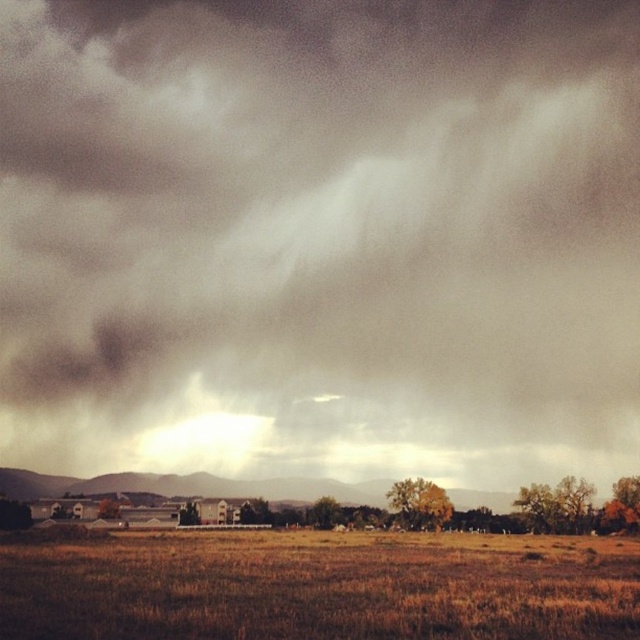
Does dark gray cloud at upper center have a lesser width compared to brown dry grass at lower center?

Incorrect, dark gray cloud at upper center's width is not less than brown dry grass at lower center's.

Between point (406, 70) and point (627, 582), which one is positioned in front?

Point (627, 582)

Who is more distant from viewer, (8, 456) or (504, 637)?

Positioned behind is point (8, 456).

Where is `dark gray cloud at upper center`? dark gray cloud at upper center is located at coordinates (317, 228).